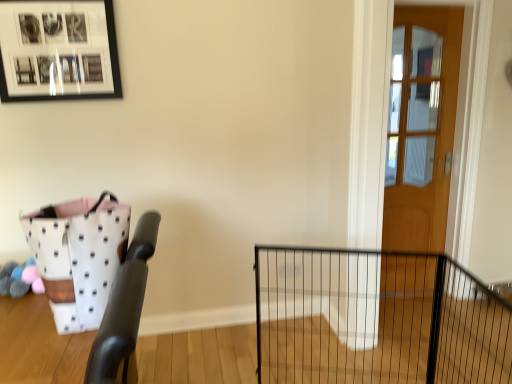
Question: Is white dotted fabric basket at left directly adjacent to black matte picture frame at upper left?

Choices:
 (A) yes
 (B) no

Answer: (B)

Question: Is white dotted fabric basket at left positioned before black matte picture frame at upper left?

Choices:
 (A) no
 (B) yes

Answer: (B)

Question: Does white dotted fabric basket at left have a smaller size compared to black matte picture frame at upper left?

Choices:
 (A) no
 (B) yes

Answer: (A)

Question: Considering the relative sizes of white dotted fabric basket at left and black matte picture frame at upper left in the image provided, is white dotted fabric basket at left thinner than black matte picture frame at upper left?

Choices:
 (A) yes
 (B) no

Answer: (B)

Question: From the image's perspective, is white dotted fabric basket at left on black matte picture frame at upper left?

Choices:
 (A) no
 (B) yes

Answer: (A)

Question: Can you confirm if white dotted fabric basket at left is bigger than black matte picture frame at upper left?

Choices:
 (A) no
 (B) yes

Answer: (B)

Question: Does black wire fence at center come behind white dotted fabric basket at left?

Choices:
 (A) yes
 (B) no

Answer: (A)

Question: Is black wire fence at center to the right of white dotted fabric basket at left from the viewer's perspective?

Choices:
 (A) yes
 (B) no

Answer: (A)

Question: From the image's perspective, does black wire fence at center appear higher than white dotted fabric basket at left?

Choices:
 (A) no
 (B) yes

Answer: (A)

Question: Considering the relative sizes of black wire fence at center and white dotted fabric basket at left in the image provided, is black wire fence at center taller than white dotted fabric basket at left?

Choices:
 (A) no
 (B) yes

Answer: (B)

Question: Considering the relative sizes of black wire fence at center and white dotted fabric basket at left in the image provided, is black wire fence at center shorter than white dotted fabric basket at left?

Choices:
 (A) no
 (B) yes

Answer: (A)

Question: Considering the relative sizes of black wire fence at center and white dotted fabric basket at left in the image provided, is black wire fence at center bigger than white dotted fabric basket at left?

Choices:
 (A) yes
 (B) no

Answer: (A)

Question: Is white dotted fabric basket at left further to camera compared to wooden door at right?

Choices:
 (A) yes
 (B) no

Answer: (B)